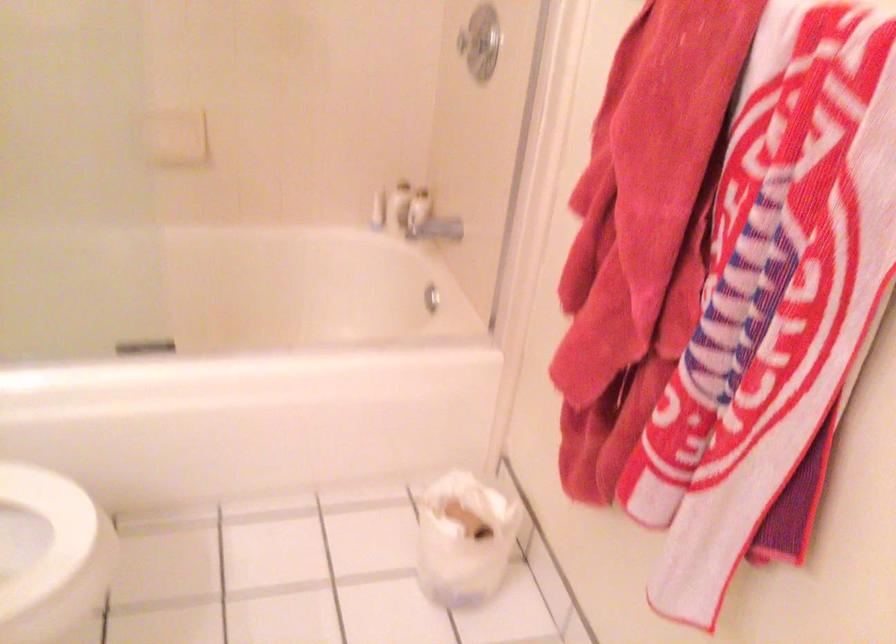
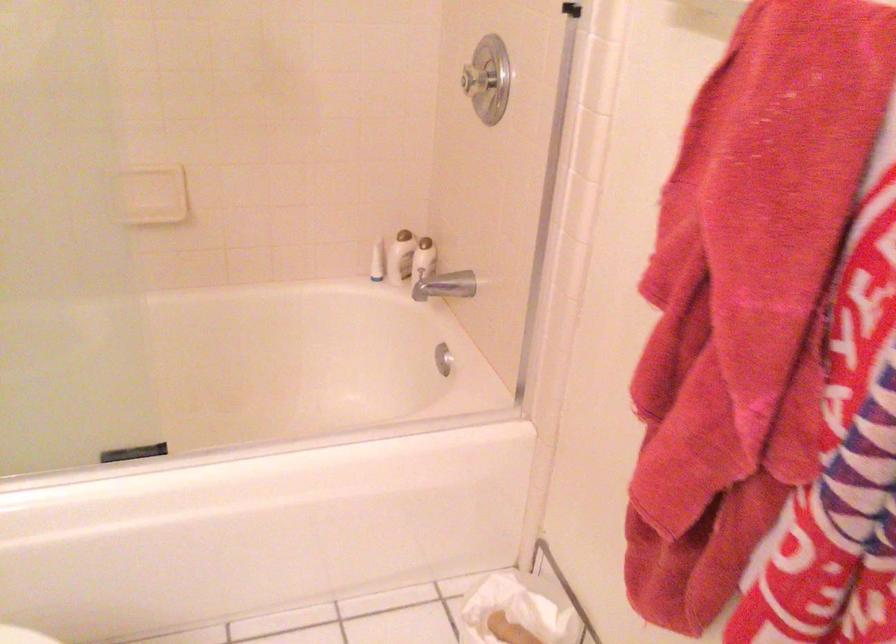
What movement of the cameraman would produce the second image?

The movement direction of the cameraman is left, forward.